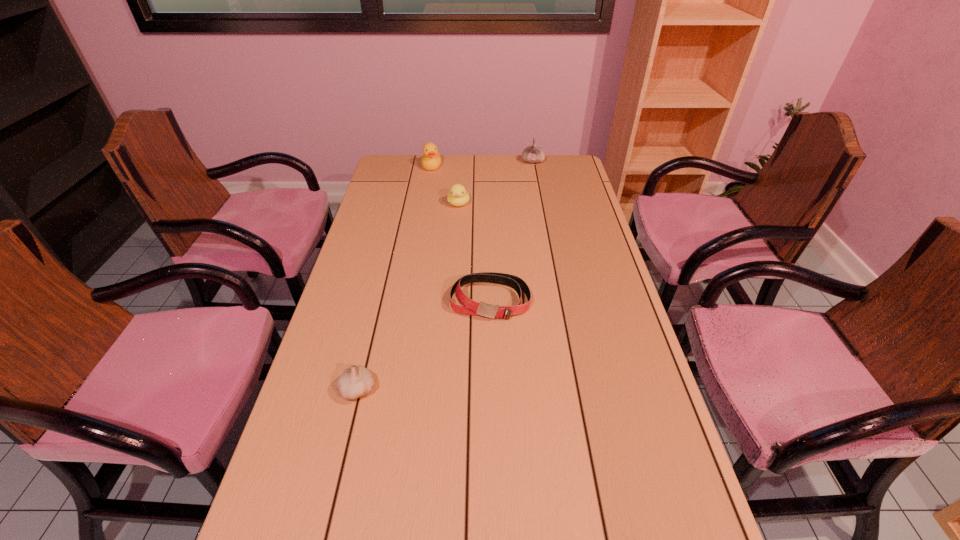
What are the coordinates of `free spot between the second nearest object and the shorter garlic` in the screenshot? It's located at (424, 345).

This screenshot has width=960, height=540. Find the location of `vacant space that's between the rightmost object and the third nearest object`. vacant space that's between the rightmost object and the third nearest object is located at coordinates (495, 183).

Locate an element on the screen. Image resolution: width=960 pixels, height=540 pixels. vacant space in between the duck and the left garlic is located at coordinates [x=396, y=278].

The image size is (960, 540). I want to click on vacant space that's between the duck and the third nearest object, so point(445,185).

Find the location of `free space between the taller garlic and the duck`. free space between the taller garlic and the duck is located at coordinates (482, 164).

You are a GUI agent. You are given a task and a screenshot of the screen. Output one action in this format:
    pyautogui.click(x=<x>, y=<y>)
    Task: Click on the free point between the duck and the rightmost object
    This screenshot has width=960, height=540.
    Given the screenshot: What is the action you would take?
    pyautogui.click(x=482, y=164)

Where is `free space between the duck and the third farthest object`? free space between the duck and the third farthest object is located at coordinates (445, 185).

This screenshot has width=960, height=540. What are the coordinates of `empty space that is in between the left garlic and the second nearest object` in the screenshot? It's located at (424, 345).

Identify the location of free space that is in between the shorter garlic and the duck. The image size is (960, 540). (396, 278).

Where is `free space between the rightmost object and the dog collar`? free space between the rightmost object and the dog collar is located at coordinates (512, 231).